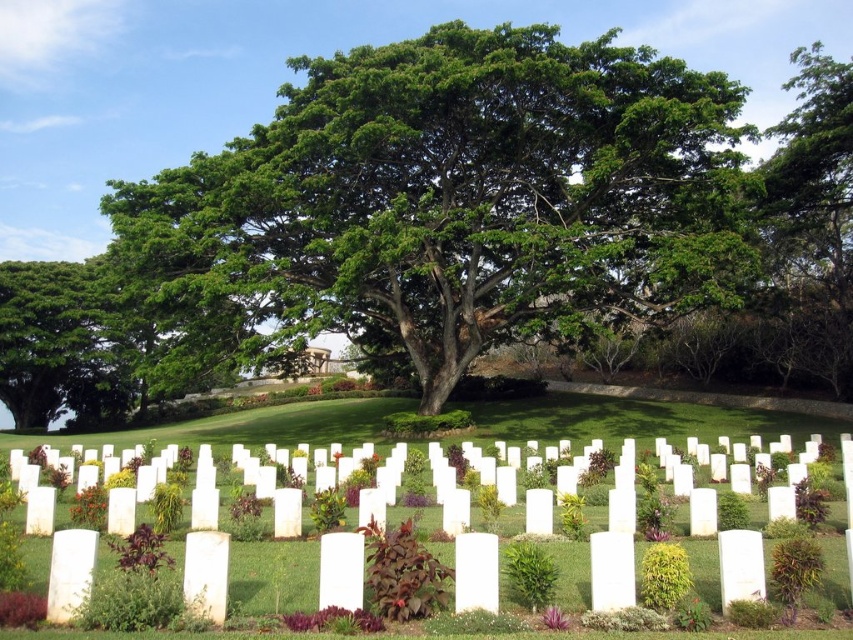
You are standing in the cemetery and want to place a new headstone between the green leafy tree at center and the white matte headstones at center. Based on their positions, where should the new headstone be placed?

The green leafy tree at center is positioned over the white matte headstones at center, so the new headstone should be placed below the green leafy tree at center where the white matte headstones at center are located.

You are standing at the center of the cemetery and want to take a photo of the green leafy tree at center. Which direction should you point your camera to capture it?

The green leafy tree at center is located at point 0.325 on the x and 0.528 on the y axis, so you should point your camera slightly to the left and upwards to capture it.

You are a groundskeeper who needs to water both the green leafy tree at center and the white matte headstones at center. You have a hose that can reach 10 meters. Starting from the tree, can you water the headstones without moving the hose nozzle?

The distance between the green leafy tree at center and the white matte headstones at center is 15.02 meters. Since the hose can only reach 10 meters, you cannot water the headstones without moving the hose nozzle.